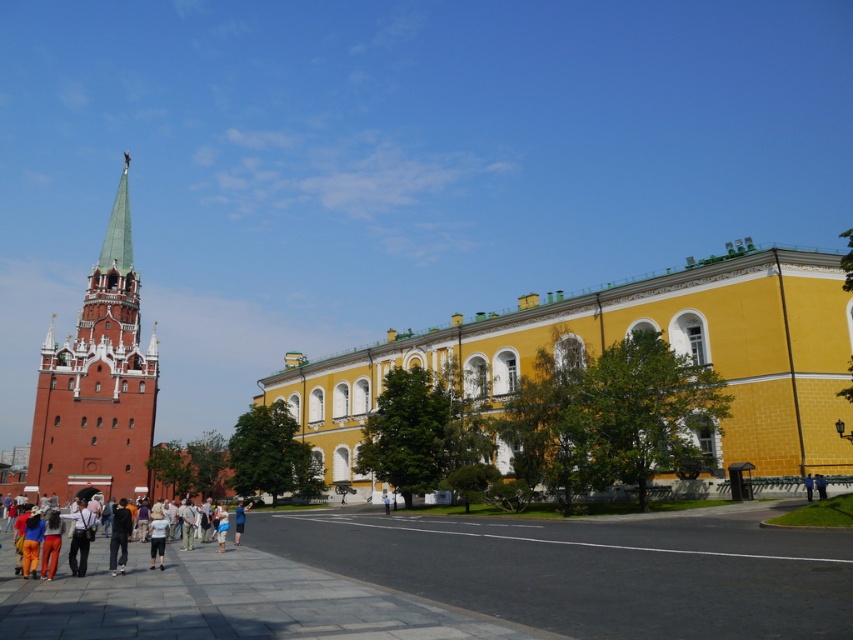
Is gray concrete plaza at lower left bigger than brick tower at left?

Incorrect, gray concrete plaza at lower left is not larger than brick tower at left.

Looking at this image, who is positioned more to the left, gray concrete plaza at lower left or brick tower at left?

brick tower at left is more to the left.

Which is in front, point (21, 625) or point (103, 284)?

Positioned in front is point (21, 625).

Identify the location of gray concrete plaza at lower left. This screenshot has height=640, width=853. (454, 580).

Does brick tower at left have a smaller size compared to multicolored clothing at center?

Actually, brick tower at left might be larger than multicolored clothing at center.

Who is more distant from viewer, (91, 465) or (99, 556)?

Point (91, 465)

You are a GUI agent. You are given a task and a screenshot of the screen. Output one action in this format:
    pyautogui.click(x=<x>, y=<y>)
    Task: Click on the brick tower at left
    Image resolution: width=853 pixels, height=640 pixels.
    Given the screenshot: What is the action you would take?
    pyautogui.click(x=97, y=381)

Does blue denim jeans at center have a larger size compared to blue fabric person at center?

Yes.

Does point (250, 502) come in front of point (811, 490)?

That is False.

Identify the location of blue denim jeans at center. (239, 518).